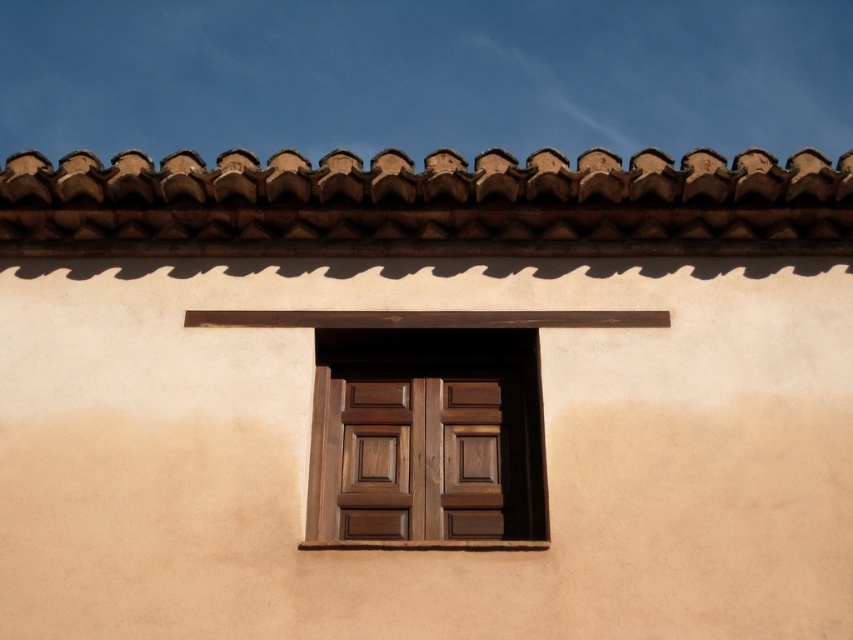
Question: Which point appears farthest from the camera in this image?

Choices:
 (A) (30, 157)
 (B) (403, 532)

Answer: (A)

Question: Which point is closer to the camera?

Choices:
 (A) dark wood window at center
 (B) brown textured tiles at top

Answer: (A)

Question: Does brown textured tiles at top appear over dark wood window at center?

Choices:
 (A) no
 (B) yes

Answer: (B)

Question: In this image, where is brown textured tiles at top located relative to dark wood window at center?

Choices:
 (A) above
 (B) below

Answer: (A)

Question: Is brown textured tiles at top to the left of dark wood window at center from the viewer's perspective?

Choices:
 (A) no
 (B) yes

Answer: (B)